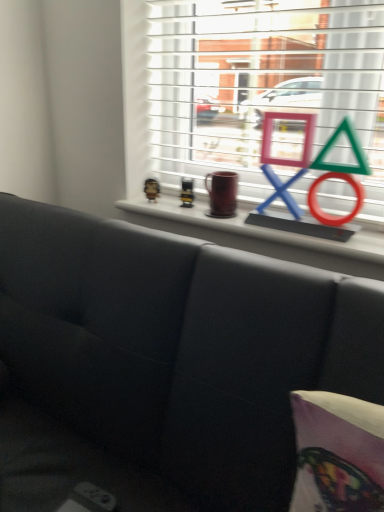
Question: Is metallic silver toy at upper center, the 2th toy from the left, completely or partially outside of metallic gold figurine at upper center, the first toy from the left?

Choices:
 (A) yes
 (B) no

Answer: (A)

Question: Would you consider metallic silver toy at upper center, the 1th toy positioned from the right, to be distant from metallic gold figurine at upper center, the first toy from the left?

Choices:
 (A) no
 (B) yes

Answer: (A)

Question: Considering the relative sizes of metallic silver toy at upper center, the 2th toy from the left, and metallic gold figurine at upper center, the first toy from the left, in the image provided, is metallic silver toy at upper center, the 2th toy from the left, wider than metallic gold figurine at upper center, the first toy from the left,?

Choices:
 (A) no
 (B) yes

Answer: (A)

Question: Is metallic silver toy at upper center, the 2th toy from the left, bigger than metallic gold figurine at upper center, which is the second toy from right to left?

Choices:
 (A) no
 (B) yes

Answer: (A)

Question: Does metallic silver toy at upper center, the 1th toy positioned from the right, have a greater height compared to metallic gold figurine at upper center, the first toy from the left?

Choices:
 (A) no
 (B) yes

Answer: (B)

Question: Considering the positions of metallic gold figurine at upper center, which is the second toy from right to left, and metallic silver toy at upper center, the 1th toy positioned from the right, in the image, is metallic gold figurine at upper center, which is the second toy from right to left, wider or thinner than metallic silver toy at upper center, the 1th toy positioned from the right,?

Choices:
 (A) thin
 (B) wide

Answer: (B)

Question: Considering the positions of metallic gold figurine at upper center, the first toy from the left, and metallic silver toy at upper center, the 1th toy positioned from the right, in the image, is metallic gold figurine at upper center, the first toy from the left, taller or shorter than metallic silver toy at upper center, the 1th toy positioned from the right,?

Choices:
 (A) short
 (B) tall

Answer: (A)

Question: Considering the positions of metallic gold figurine at upper center, the first toy from the left, and metallic silver toy at upper center, the 1th toy positioned from the right, in the image, is metallic gold figurine at upper center, the first toy from the left, bigger or smaller than metallic silver toy at upper center, the 1th toy positioned from the right,?

Choices:
 (A) small
 (B) big

Answer: (B)

Question: Relative to metallic silver toy at upper center, the 1th toy positioned from the right, is metallic gold figurine at upper center, the first toy from the left, in front or behind?

Choices:
 (A) front
 (B) behind

Answer: (B)

Question: Considering their positions, is matte black couch at center located in front of or behind metallic gold figurine at upper center, which is the second toy from right to left?

Choices:
 (A) behind
 (B) front

Answer: (B)

Question: Considering the positions of matte black couch at center and metallic gold figurine at upper center, which is the second toy from right to left, in the image, is matte black couch at center taller or shorter than metallic gold figurine at upper center, which is the second toy from right to left,?

Choices:
 (A) short
 (B) tall

Answer: (B)

Question: Is matte black couch at center to the left or to the right of metallic gold figurine at upper center, which is the second toy from right to left, in the image?

Choices:
 (A) left
 (B) right

Answer: (A)

Question: From a real-world perspective, relative to metallic gold figurine at upper center, the first toy from the left, is matte black couch at center vertically above or below?

Choices:
 (A) above
 (B) below

Answer: (B)

Question: From the image's perspective, is metallic gold figurine at upper center, the first toy from the left, located above or below matte black couch at center?

Choices:
 (A) above
 (B) below

Answer: (A)

Question: From a real-world perspective, is metallic gold figurine at upper center, which is the second toy from right to left, physically located above or below matte black couch at center?

Choices:
 (A) below
 (B) above

Answer: (B)